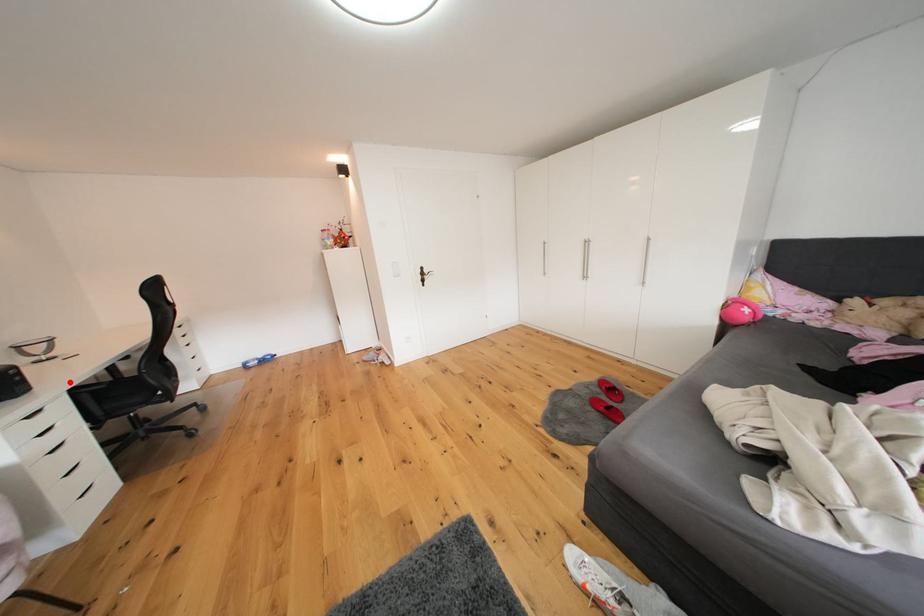
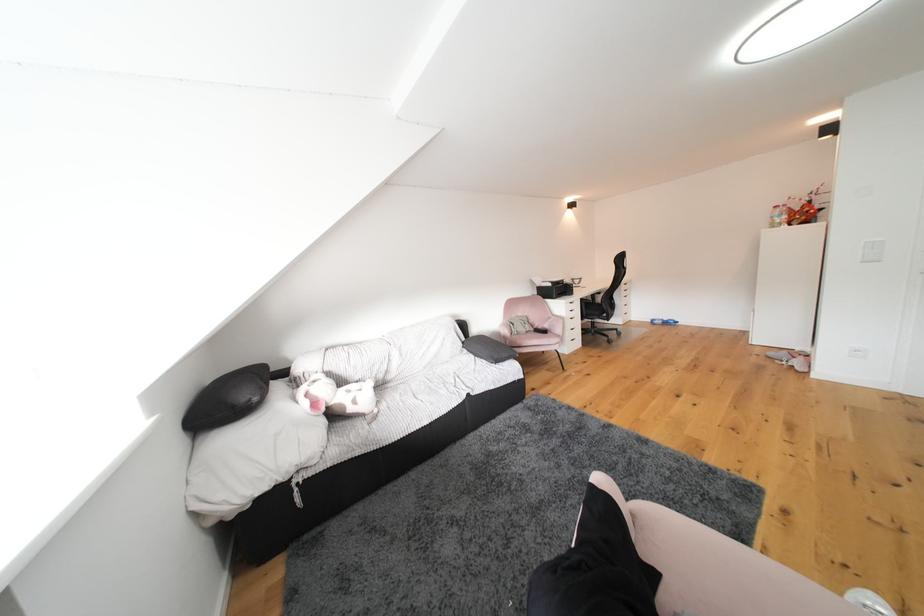
In the second image, find the point that corresponds to the highlighted location in the first image.

(590, 297)